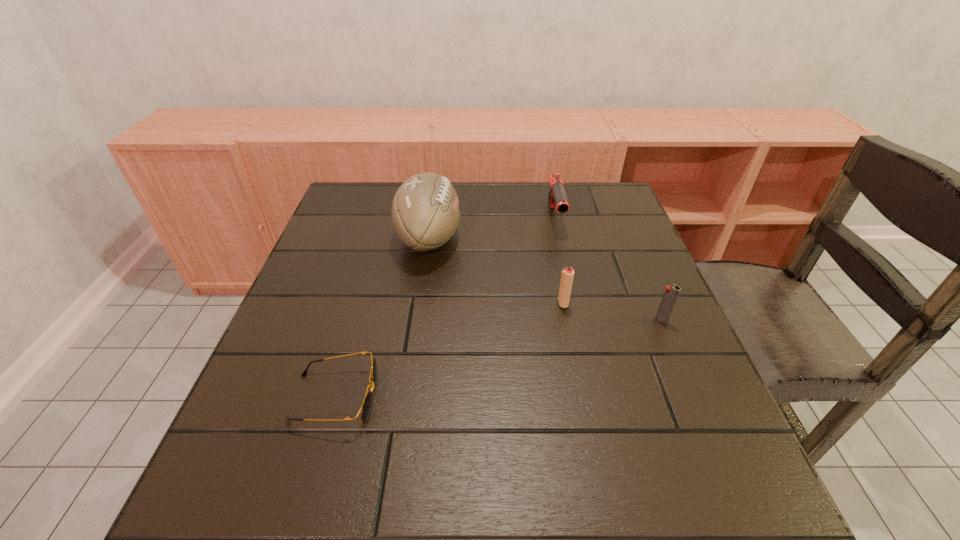
At what (x,y) coordinates should I click in order to perform the action: click on free space in the image that satisfies the following two spatial constraints: 1. at the aiming end of the gun; 2. on the front-facing side of the sunglasses. Please return your answer as a coordinate pair (x, y). The image size is (960, 540). Looking at the image, I should click on (595, 398).

I want to click on free space that satisfies the following two spatial constraints: 1. on the laces of the third farthest object; 2. on the right side of the football (American), so [x=420, y=303].

Where is `free space that satisfies the following two spatial constraints: 1. at the aiming end of the gun; 2. on the left side of the second nearest object`? The width and height of the screenshot is (960, 540). free space that satisfies the following two spatial constraints: 1. at the aiming end of the gun; 2. on the left side of the second nearest object is located at coordinates (578, 320).

I want to click on vacant position in the image that satisfies the following two spatial constraints: 1. at the aiming end of the gun; 2. on the front-facing side of the nearest object, so click(x=595, y=398).